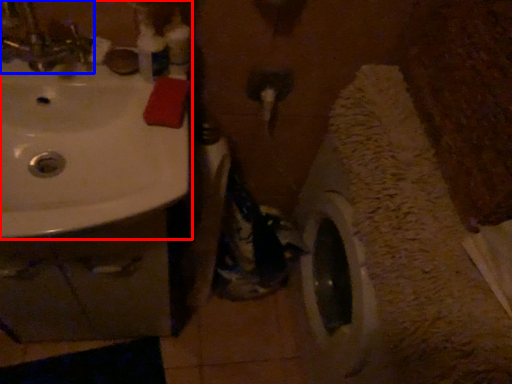
Question: Which point is closer to the camera, sink (highlighted by a red box) or tap (highlighted by a blue box)?

Choices:
 (A) sink
 (B) tap

Answer: (B)